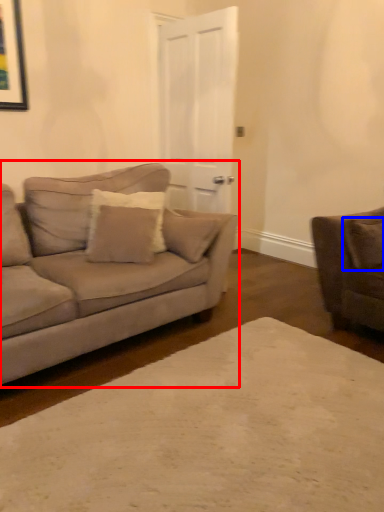
Question: Which object is closer to the camera taking this photo, studio couch (highlighted by a red box) or pillow (highlighted by a blue box)?

Choices:
 (A) studio couch
 (B) pillow

Answer: (A)